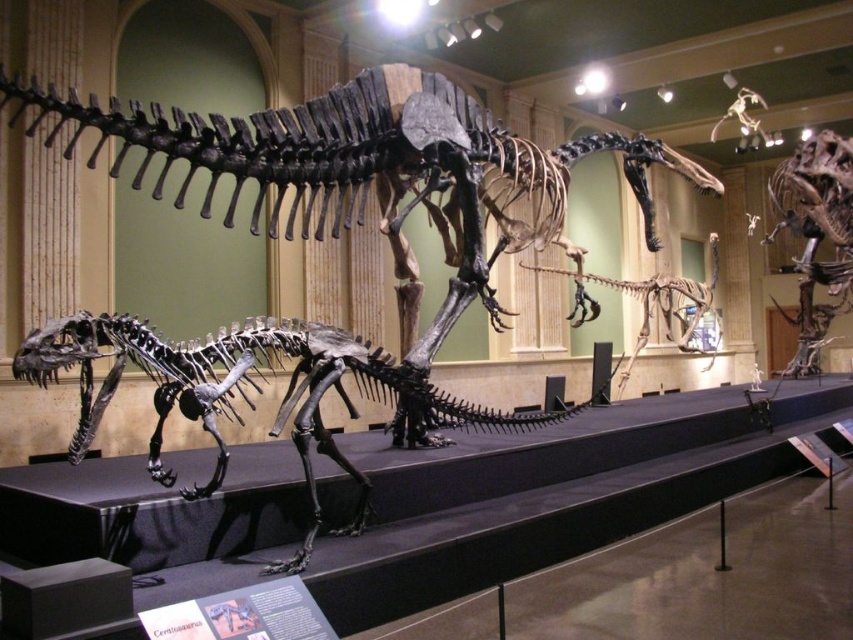
Question: Where is brown bone-like dinosaur at center located in relation to bone-like skeleton at center in the image?

Choices:
 (A) above
 (B) below

Answer: (A)

Question: Which object appears closest to the camera in this image?

Choices:
 (A) brown bone-like dinosaur at center
 (B) black metallic dinosaur at center
 (C) bone-like skeleton at center

Answer: (B)

Question: Among these objects, which one is nearest to the camera?

Choices:
 (A) bone-like skeleton at center
 (B) brown bone-like dinosaur at center

Answer: (A)

Question: Can you confirm if black metallic dinosaur at center is bigger than brown bone-like dinosaur at center?

Choices:
 (A) no
 (B) yes

Answer: (B)

Question: Can you confirm if brown bone-like dinosaur at center is smaller than bone-like skeleton at center?

Choices:
 (A) no
 (B) yes

Answer: (B)

Question: Which object is the closest to the bone-like skeleton at center?

Choices:
 (A) brown bone-like dinosaur at center
 (B) black metallic dinosaur at center

Answer: (A)